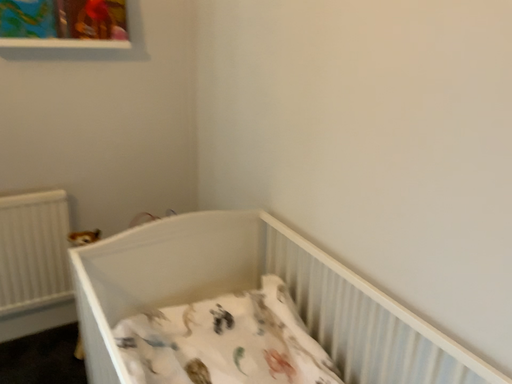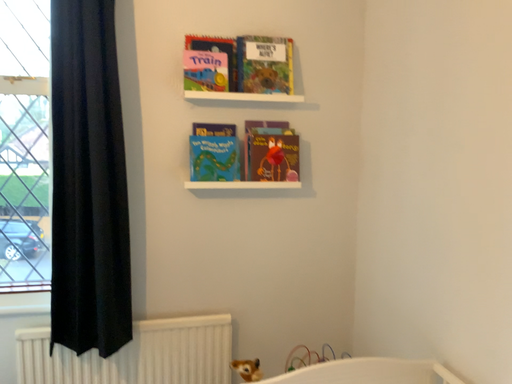
Question: How did the camera likely rotate when shooting the video?

Choices:
 (A) rotated left
 (B) rotated right

Answer: (A)